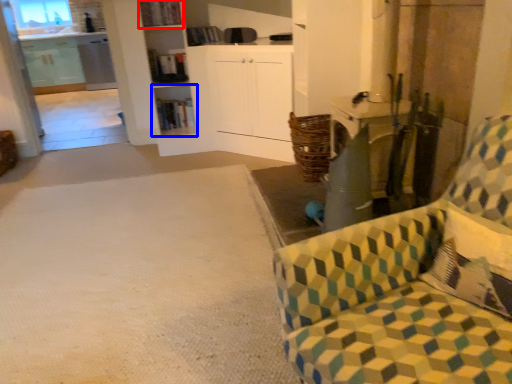
Question: Which object is closer to the camera taking this photo, shelf (highlighted by a red box) or shelf (highlighted by a blue box)?

Choices:
 (A) shelf
 (B) shelf

Answer: (A)